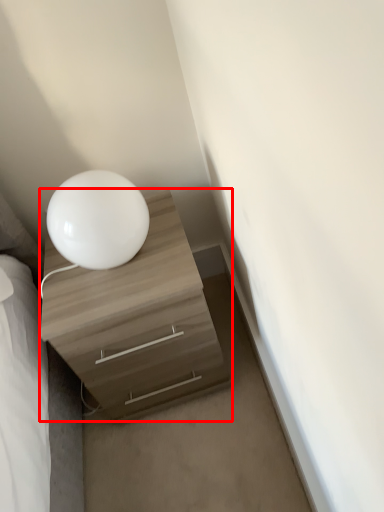
Question: From the image's perspective, where is chest of drawers (annotated by the red box) located in relation to table lamp in the image?

Choices:
 (A) below
 (B) above

Answer: (A)